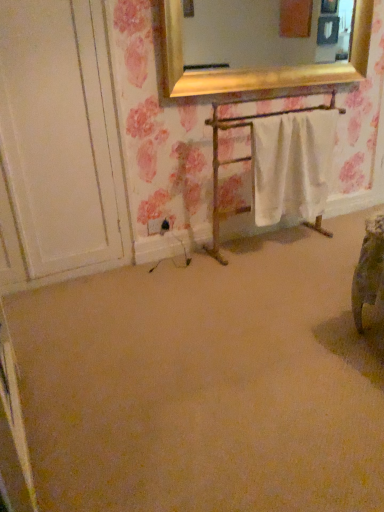
Describe the element at coordinates (207, 383) in the screenshot. I see `beige carpet at center` at that location.

You are a GUI agent. You are given a task and a screenshot of the screen. Output one action in this format:
    pyautogui.click(x=<x>, y=<y>)
    Task: Click on the white fabric towel rack at center
    The width and height of the screenshot is (384, 512).
    Given the screenshot: What is the action you would take?
    pyautogui.click(x=241, y=161)

Does black plastic electric outlet at lower left come in front of beige carpet at center?

That is False.

Which of these two, black plastic electric outlet at lower left or beige carpet at center, is wider?

Wider between the two is beige carpet at center.

From a real-world perspective, relative to beige carpet at center, is black plastic electric outlet at lower left vertically above or below?

In terms of real-world spatial position, black plastic electric outlet at lower left is above beige carpet at center.

Is black plastic electric outlet at lower left positioned with its back to beige carpet at center?

No, black plastic electric outlet at lower left is not facing away from beige carpet at center.

Which of these two, beige carpet at center or black plastic electric outlet at lower left, stands taller?

Standing taller between the two is black plastic electric outlet at lower left.

Is beige carpet at center oriented towards black plastic electric outlet at lower left?

No, beige carpet at center is not facing towards black plastic electric outlet at lower left.

Considering the positions of objects beige carpet at center and black plastic electric outlet at lower left in the image provided, who is behind, beige carpet at center or black plastic electric outlet at lower left?

Positioned behind is black plastic electric outlet at lower left.

Based on the photo, considering the relative sizes of white cotton towel at center and white fabric towel rack at center in the image provided, is white cotton towel at center taller than white fabric towel rack at center?

Incorrect, the height of white cotton towel at center is not larger of that of white fabric towel rack at center.

Is white cotton towel at center not within white fabric towel rack at center?

No.

Is white cotton towel at center far away from white fabric towel rack at center?

That's not correct — white cotton towel at center is a little close to white fabric towel rack at center.

Is white cotton towel at center at the right side of white fabric towel rack at center?

Yes, white cotton towel at center is to the right of white fabric towel rack at center.

Which is more to the right, beige carpet at center or white cotton towel at center?

beige carpet at center.

From the image's perspective, relative to white cotton towel at center, is beige carpet at center above or below?

beige carpet at center is below white cotton towel at center.

Between beige carpet at center and white cotton towel at center, which one has smaller size?

With smaller size is white cotton towel at center.

From a real-world perspective, which object stands above the other?

In real-world perspective, white cotton towel at center is above.

What's the angular difference between white fabric towel rack at center and white cotton towel at center's facing directions?

They differ by 0.000598 degrees in their facing directions.

Are white fabric towel rack at center and white cotton towel at center located far from each other?

white fabric towel rack at center is actually quite close to white cotton towel at center.

From a real-world perspective, is white fabric towel rack at center on top of white cotton towel at center?

No, from a real-world perspective, white fabric towel rack at center is not over white cotton towel at center

Which object is wider, white fabric towel rack at center or white cotton towel at center?

With larger width is white fabric towel rack at center.

Is the depth of white cotton towel at center less than that of black plastic electric outlet at lower left?

Yes, it is.

From the image's perspective, is white cotton towel at center under black plastic electric outlet at lower left?

No, from the image's perspective, white cotton towel at center is not beneath black plastic electric outlet at lower left.

Would you say white cotton towel at center contains black plastic electric outlet at lower left?

Actually, black plastic electric outlet at lower left is outside white cotton towel at center.

Looking at this image, can you confirm if white cotton towel at center is thinner than black plastic electric outlet at lower left?

No, white cotton towel at center is not thinner than black plastic electric outlet at lower left.

Would you consider black plastic electric outlet at lower left to be distant from white cotton towel at center?

Actually, black plastic electric outlet at lower left and white cotton towel at center are a little close together.

Does black plastic electric outlet at lower left have a greater height compared to white cotton towel at center?

In fact, black plastic electric outlet at lower left may be shorter than white cotton towel at center.

Which is correct: black plastic electric outlet at lower left is inside white cotton towel at center, or outside of it?

The correct answer is: outside.

In the image, there is a beige carpet at center. Identify the location of electric outlet above it (from the image's perspective). Image resolution: width=384 pixels, height=512 pixels. (158, 226).

Image resolution: width=384 pixels, height=512 pixels. I want to click on plain below the black plastic electric outlet at lower left (from the image's perspective), so click(207, 383).

When comparing their distances from beige carpet at center, does black plastic electric outlet at lower left or white fabric towel rack at center seem further?

The object further to beige carpet at center is black plastic electric outlet at lower left.

From the image, which object appears to be nearer to beige carpet at center, white cotton towel at center or white fabric towel rack at center?

white cotton towel at center is positioned closer to the anchor beige carpet at center.

When comparing their distances from white cotton towel at center, does black plastic electric outlet at lower left or white fabric towel rack at center seem closer?

white fabric towel rack at center is positioned closer to the anchor white cotton towel at center.

Consider the image. Estimate the real-world distances between objects in this image. Which object is closer to white fabric towel rack at center, beige carpet at center or black plastic electric outlet at lower left?

black plastic electric outlet at lower left is positioned closer to the anchor white fabric towel rack at center.

Based on their spatial positions, is white cotton towel at center or black plastic electric outlet at lower left further from white fabric towel rack at center?

black plastic electric outlet at lower left lies further to white fabric towel rack at center than the other object.

Based on their spatial positions, is white fabric towel rack at center or beige carpet at center further from black plastic electric outlet at lower left?

Among the two, beige carpet at center is located further to black plastic electric outlet at lower left.

When comparing their distances from white cotton towel at center, does beige carpet at center or black plastic electric outlet at lower left seem closer?

Based on the image, black plastic electric outlet at lower left appears to be nearer to white cotton towel at center.

Looking at the image, which one is located closer to black plastic electric outlet at lower left, beige carpet at center or white fabric towel rack at center?

Among the two, white fabric towel rack at center is located nearer to black plastic electric outlet at lower left.

Find the location of a particular element. furniture positioned between beige carpet at center and white cotton towel at center from near to far is located at coordinates (241, 161).

Where is `bath towel between beige carpet at center and black plastic electric outlet at lower left in the front-back direction`? The width and height of the screenshot is (384, 512). bath towel between beige carpet at center and black plastic electric outlet at lower left in the front-back direction is located at coordinates (293, 165).

The width and height of the screenshot is (384, 512). I want to click on furniture located between beige carpet at center and black plastic electric outlet at lower left in the depth direction, so click(241, 161).

Identify the location of furniture situated between black plastic electric outlet at lower left and white cotton towel at center from left to right. (241, 161).